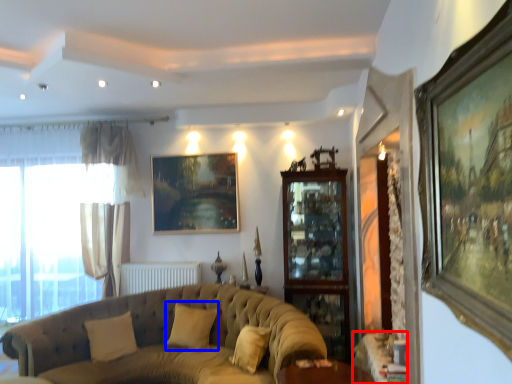
Question: Which object appears closest to the camera in this image, table (highlighted by a red box) or pillow (highlighted by a blue box)?

Choices:
 (A) table
 (B) pillow

Answer: (A)